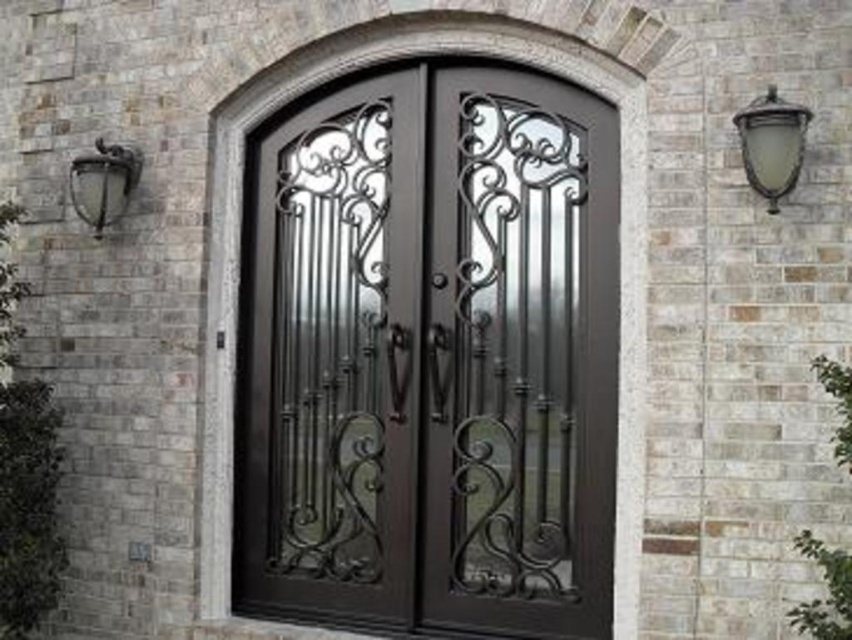
Question: Is dark brown wrought iron door at center closer to the viewer compared to metallic wrought iron lamp at left?

Choices:
 (A) no
 (B) yes

Answer: (B)

Question: Which of the following is the closest to the observer?

Choices:
 (A) (274, 376)
 (B) (122, 211)
 (C) (422, 166)
 (D) (799, 109)

Answer: (D)

Question: Does dark brown wrought iron at center have a larger size compared to metallic wrought iron lamp at left?

Choices:
 (A) no
 (B) yes

Answer: (B)

Question: Estimate the real-world distances between objects in this image. Which object is farther from the dark brown wrought iron at center?

Choices:
 (A) metallic wrought iron lamp at left
 (B) matte glass lamp at upper right

Answer: (A)

Question: Does dark brown wrought iron at center lie behind metallic wrought iron lamp at left?

Choices:
 (A) no
 (B) yes

Answer: (A)

Question: Which object is positioned farthest from the matte glass lamp at upper right?

Choices:
 (A) dark brown wrought iron at center
 (B) dark brown wrought iron door at center
 (C) metallic wrought iron lamp at left

Answer: (C)